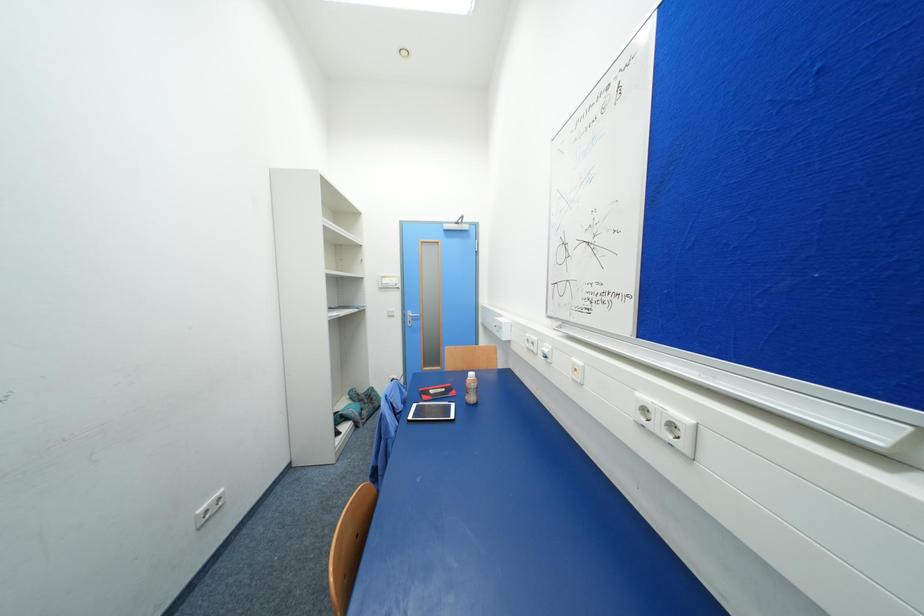
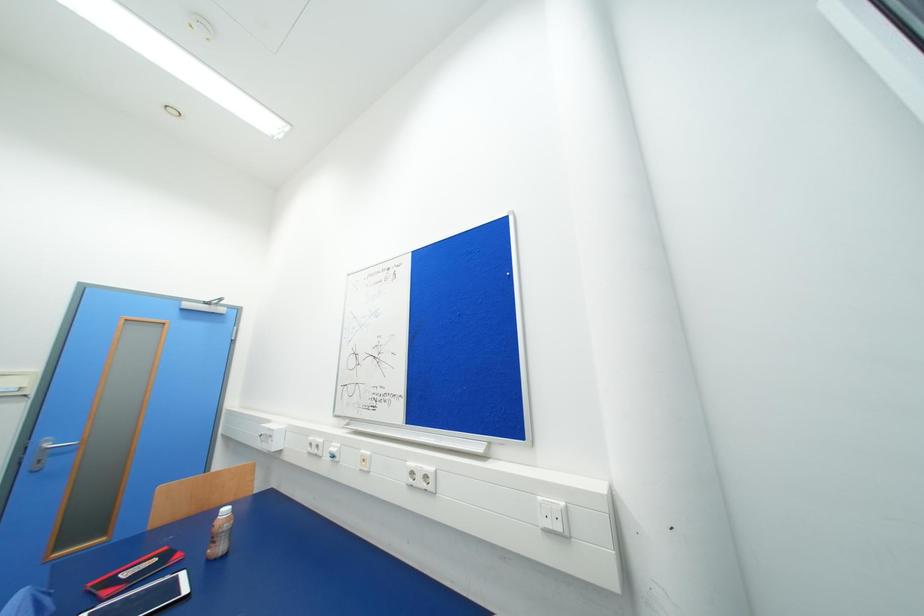
From the picture: Based on the continuous images, in which direction is the camera rotating?

The rotation direction of the camera is right-up.